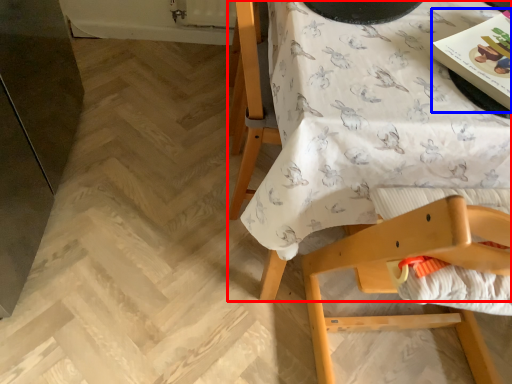
Question: Which of the following is the farthest to the observer, table (highlighted by a red box) or magazine (highlighted by a blue box)?

Choices:
 (A) table
 (B) magazine

Answer: (B)